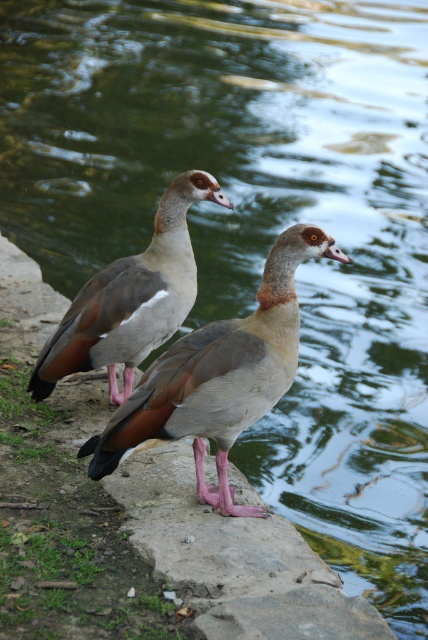
Looking at this image, you are a wildlife photographer aiming to capture the brown matte goose at center. Based on the coordinates provided, where should you position your camera relative to the image frame?

The brown matte goose at center is located at coordinates point (x=219, y=376), which is slightly to the right and above the center of the image frame. Position your camera to aim towards that point to capture the goose.

You are a wildlife photographer aiming to capture both the brown matte goose at center and the brown matte goose at upper left in a single frame. Given their sizes, which goose would appear closer to the camera in the photo?

The brown matte goose at center is smaller than the brown matte goose at upper left. Since smaller objects in a photo appear farther away, the brown matte goose at center would be farther from the camera, making the brown matte goose at upper left closer to the camera.

You are a wildlife photographer aiming to capture a closeup of the brown matte goose at center. Your camera has a maximum focus range of 3 meters. Can you get a clear closeup shot from your current position?

The brown matte goose at center is 3.50 meters away from the camera. Since the maximum focus range is 3 meters, the camera cannot focus clearly at this distance, so a clear closeup shot is not possible from the current position.